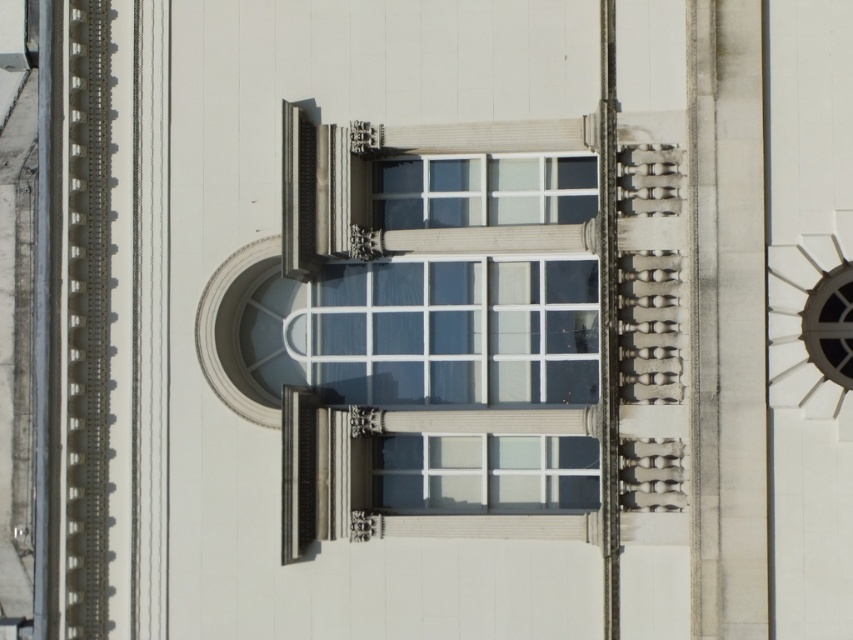
Question: Is clear glass window at center smaller than metallic silver clock at right?

Choices:
 (A) no
 (B) yes

Answer: (B)

Question: From the image, what is the correct spatial relationship of clear glass window at center in relation to metallic silver clock at right?

Choices:
 (A) left
 (B) right

Answer: (A)

Question: Which point is farther from the camera taking this photo?

Choices:
 (A) click(828, 241)
 (B) click(426, 339)

Answer: (B)

Question: Is clear glass window at center thinner than metallic silver clock at right?

Choices:
 (A) no
 (B) yes

Answer: (B)